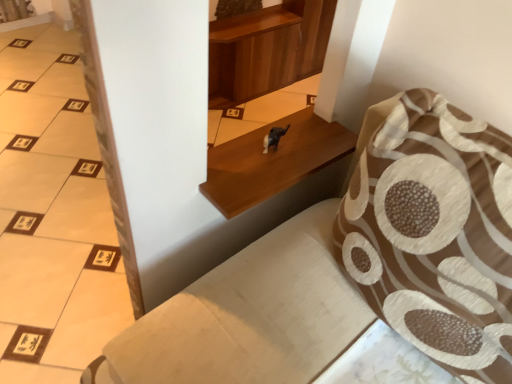
Question: Is shiny black dog at center to the right of wooden shelf at center from the viewer's perspective?

Choices:
 (A) yes
 (B) no

Answer: (B)

Question: Considering the relative sizes of shiny black dog at center and wooden shelf at center in the image provided, is shiny black dog at center thinner than wooden shelf at center?

Choices:
 (A) yes
 (B) no

Answer: (A)

Question: Can wooden shelf at center be found inside shiny black dog at center?

Choices:
 (A) no
 (B) yes

Answer: (A)

Question: Considering the relative sizes of shiny black dog at center and wooden shelf at center in the image provided, is shiny black dog at center wider than wooden shelf at center?

Choices:
 (A) yes
 (B) no

Answer: (B)

Question: From a real-world perspective, is shiny black dog at center under wooden shelf at center?

Choices:
 (A) no
 (B) yes

Answer: (A)

Question: Considering the positions of wooden shelf at center and shiny black dog at center in the image, is wooden shelf at center taller or shorter than shiny black dog at center?

Choices:
 (A) tall
 (B) short

Answer: (B)

Question: Is wooden shelf at center inside the boundaries of shiny black dog at center, or outside?

Choices:
 (A) outside
 (B) inside

Answer: (A)

Question: Is wooden shelf at center in front of or behind shiny black dog at center in the image?

Choices:
 (A) front
 (B) behind

Answer: (A)

Question: From a real-world perspective, is wooden shelf at center positioned above or below shiny black dog at center?

Choices:
 (A) below
 (B) above

Answer: (A)

Question: From the image's perspective, is brown textured pillow at upper right located above or below shiny black dog at center?

Choices:
 (A) below
 (B) above

Answer: (A)

Question: Considering the positions of brown textured pillow at upper right and shiny black dog at center in the image, is brown textured pillow at upper right taller or shorter than shiny black dog at center?

Choices:
 (A) tall
 (B) short

Answer: (A)

Question: Based on their positions, is brown textured pillow at upper right located to the left or right of shiny black dog at center?

Choices:
 (A) left
 (B) right

Answer: (B)

Question: Choose the correct answer: Is brown textured pillow at upper right inside shiny black dog at center or outside it?

Choices:
 (A) outside
 (B) inside

Answer: (A)

Question: Considering the positions of point tap(208, 188) and point tap(431, 274), is point tap(208, 188) closer or farther from the camera than point tap(431, 274)?

Choices:
 (A) farther
 (B) closer

Answer: (A)

Question: Do you think wooden shelf at center is within brown textured pillow at upper right, or outside of it?

Choices:
 (A) outside
 (B) inside

Answer: (A)